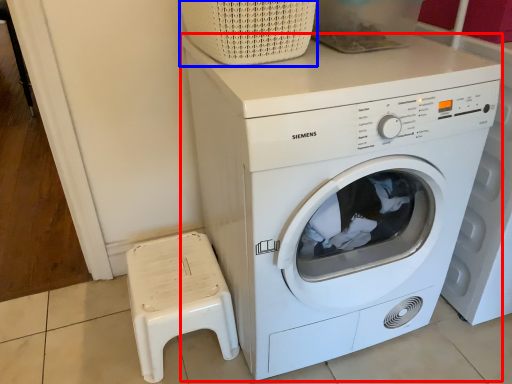
Question: Which object appears farthest to the camera in this image, washing machine (highlighted by a red box) or basket (highlighted by a blue box)?

Choices:
 (A) washing machine
 (B) basket

Answer: (B)